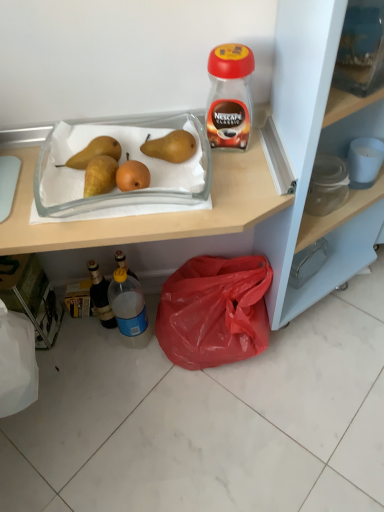
Question: Considering the relative positions of clear glass tray at center and yellow matte pear at upper left, the 2th pear from the right, in the image provided, is clear glass tray at center in front of yellow matte pear at upper left, the 2th pear from the right,?

Choices:
 (A) yes
 (B) no

Answer: (A)

Question: Considering the relative sizes of clear glass tray at center and yellow matte pear at upper left, the first pear when ordered from left to right, in the image provided, is clear glass tray at center smaller than yellow matte pear at upper left, the first pear when ordered from left to right,?

Choices:
 (A) no
 (B) yes

Answer: (A)

Question: Is clear glass tray at center not close to yellow matte pear at upper left, the 2th pear from the right?

Choices:
 (A) yes
 (B) no

Answer: (B)

Question: Is the position of clear glass tray at center more distant than that of yellow matte pear at upper left, the 2th pear from the right?

Choices:
 (A) no
 (B) yes

Answer: (A)

Question: Is clear glass tray at center touching yellow matte pear at upper left, the 2th pear from the right?

Choices:
 (A) yes
 (B) no

Answer: (A)

Question: Visually, is brown matte pear at upper center, positioned as the 2th pear in left-to-right order, positioned to the left or to the right of red plastic bag at lower right?

Choices:
 (A) left
 (B) right

Answer: (A)

Question: In the image, is brown matte pear at upper center, marked as the first pear in a right-to-left arrangement, positioned in front of or behind red plastic bag at lower right?

Choices:
 (A) front
 (B) behind

Answer: (A)

Question: From the image's perspective, relative to red plastic bag at lower right, is brown matte pear at upper center, positioned as the 2th pear in left-to-right order, above or below?

Choices:
 (A) above
 (B) below

Answer: (A)

Question: From a real-world perspective, is brown matte pear at upper center, marked as the first pear in a right-to-left arrangement, physically located above or below red plastic bag at lower right?

Choices:
 (A) above
 (B) below

Answer: (A)

Question: Considering the positions of clear glass tray at center and yellow matte pear at upper left, the first pear when ordered from left to right, in the image, is clear glass tray at center wider or thinner than yellow matte pear at upper left, the first pear when ordered from left to right,?

Choices:
 (A) wide
 (B) thin

Answer: (A)

Question: Visually, is clear glass tray at center positioned to the left or to the right of yellow matte pear at upper left, the 2th pear from the right?

Choices:
 (A) left
 (B) right

Answer: (B)

Question: Looking at the image, does clear glass tray at center seem bigger or smaller compared to yellow matte pear at upper left, the 2th pear from the right?

Choices:
 (A) big
 (B) small

Answer: (A)

Question: From their relative heights in the image, would you say clear glass tray at center is taller or shorter than yellow matte pear at upper left, the first pear when ordered from left to right?

Choices:
 (A) short
 (B) tall

Answer: (A)

Question: In terms of width, does translucent plastic bottle at lower left, the 2th bottle viewed from the right, look wider or thinner when compared to brown matte pear at upper center, marked as the first pear in a right-to-left arrangement?

Choices:
 (A) thin
 (B) wide

Answer: (A)

Question: In the image, is translucent plastic bottle at lower left, the 2th bottle viewed from the right, positioned in front of or behind brown matte pear at upper center, marked as the first pear in a right-to-left arrangement?

Choices:
 (A) behind
 (B) front

Answer: (A)